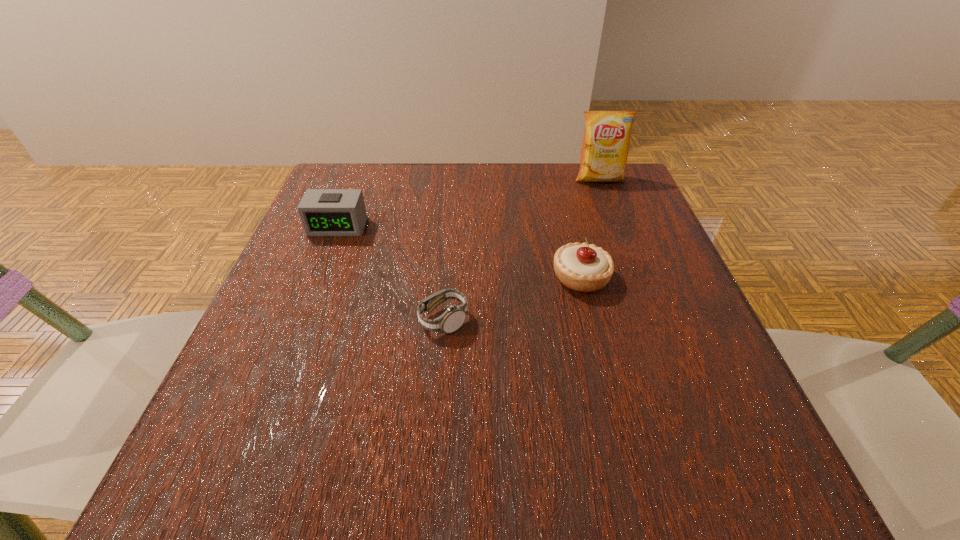
Locate an element on the screen. The image size is (960, 540). free point located 0.300m on the face of the shortest object is located at coordinates (643, 320).

Where is `crisp (potato chip) at the far edge`? crisp (potato chip) at the far edge is located at coordinates (605, 146).

The width and height of the screenshot is (960, 540). In order to click on alarm clock at the far edge in this screenshot , I will do `click(324, 212)`.

Find the location of `object at the left edge`. object at the left edge is located at coordinates (324, 212).

This screenshot has height=540, width=960. In order to click on crisp (potato chip) that is positioned at the right edge in this screenshot , I will do `click(605, 146)`.

This screenshot has height=540, width=960. I want to click on pastry located in the right edge section of the desktop, so click(580, 267).

I want to click on object that is at the far left corner, so click(324, 212).

The width and height of the screenshot is (960, 540). In order to click on object that is at the far right corner in this screenshot , I will do `click(605, 146)`.

Find the location of a particular element. vacant space at the far edge of the desktop is located at coordinates (445, 212).

Where is `blank space at the near edge of the desktop`? The height and width of the screenshot is (540, 960). blank space at the near edge of the desktop is located at coordinates (415, 449).